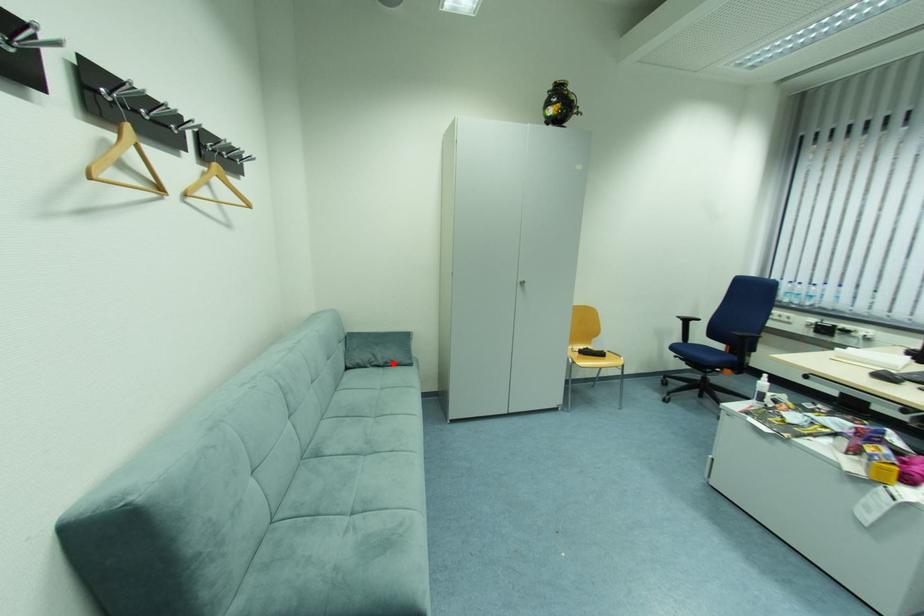
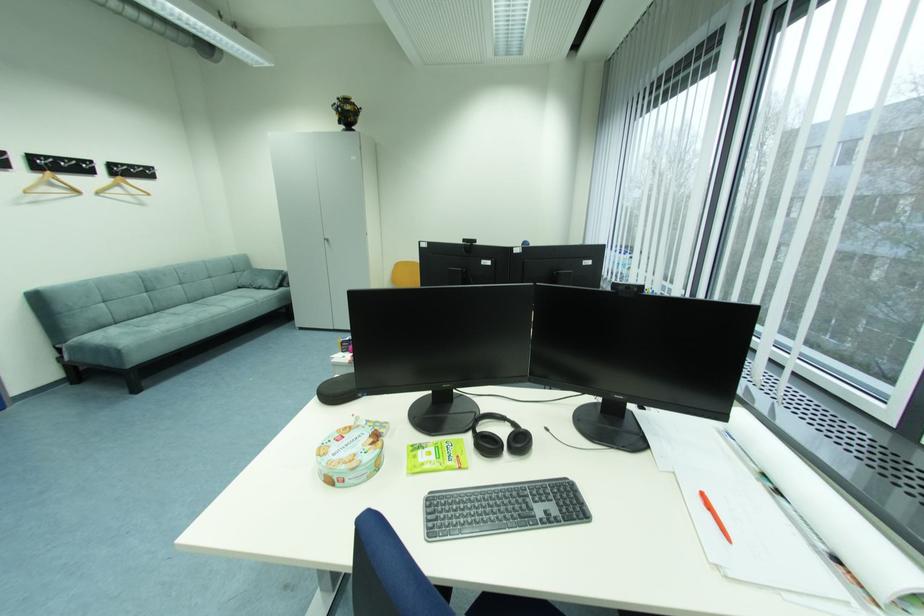
Find the pixel in the second image that matches the highlighted location in the first image.

(266, 286)